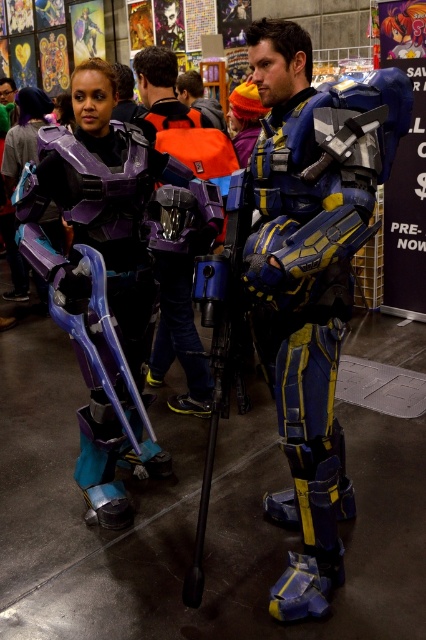
You are a game designer creating a new character for a sci fi game. You have two armor options to choose from. The first is the shiny blue armor at center, and the second is the matte black armor at center. Based on their physical characteristics, which armor would you recommend for a character that needs to move quickly through narrow corridors?

The shiny blue armor at center is thinner than the matte black armor at center, so it would be more suitable for moving quickly through narrow corridors due to its slimmer profile.

You are a game designer creating a level where both the blue metallic armor at center and the matte purple armor at left must fit through a narrow corridor. Based on their sizes, which armor might have difficulty passing through if the corridor is only wide enough for the narrower one?

The matte purple armor at left has a greater width than the blue metallic armor at center, so it might have difficulty passing through the narrow corridor designed for the narrower one.

You are a character in a futuristic game and need to move from your current position to the shiny blue armor at center without crossing the path of the matte purple armor at left. Is this possible given their positions?

The matte purple armor at left is to the left of the shiny blue armor at center. Since they are positioned side by side horizontally, you can move around either side of the matte purple armor at left to reach the shiny blue armor at center without crossing their path.